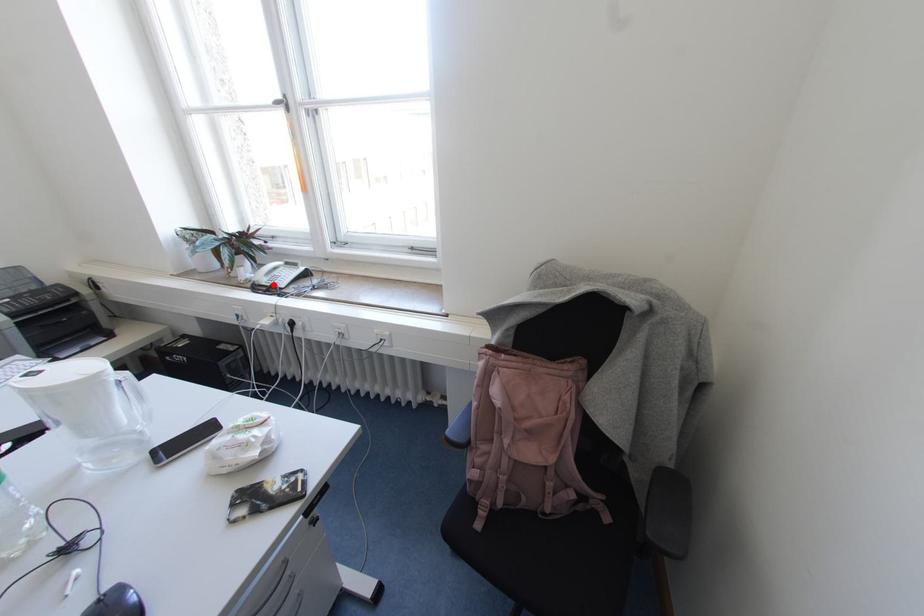
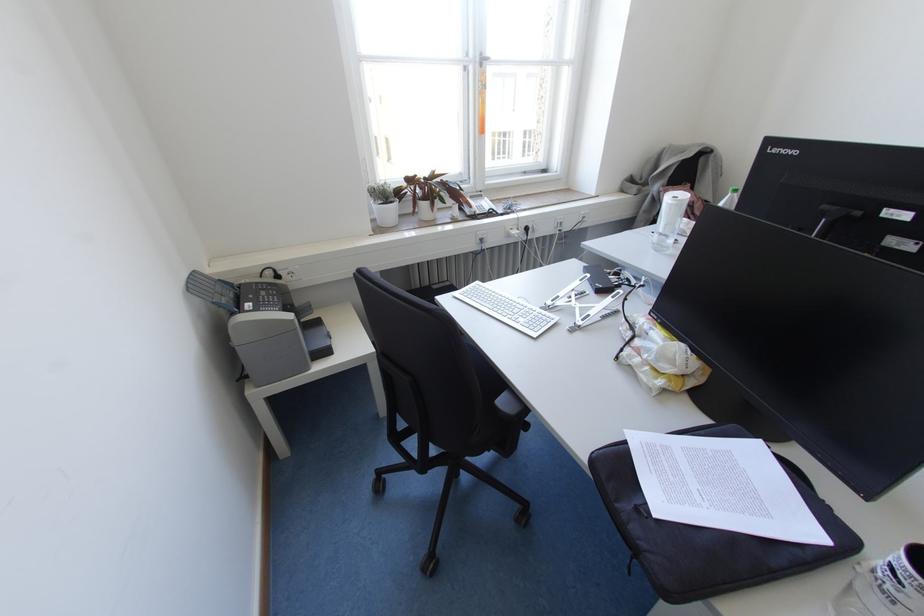
Question: I am providing you with two images of the same scene from different viewpoints. Given a red point in image1, look at the same physical point in image2. Is it:

Choices:
 (A) Closer to the viewpoint
 (B) Farther from the viewpoint

Answer: (A)